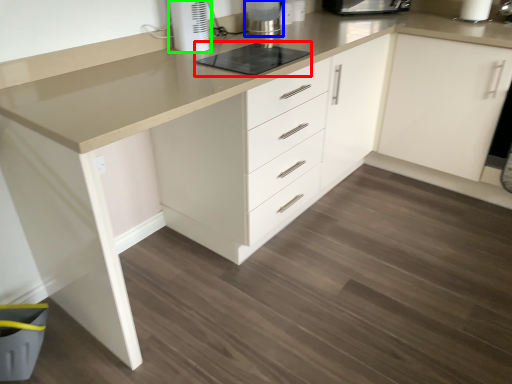
Question: Which object is the farthest from appliance (highlighted by a red box)? Choose among these: home appliance (highlighted by a blue box) or home appliance (highlighted by a green box).

Choices:
 (A) home appliance
 (B) home appliance

Answer: (A)